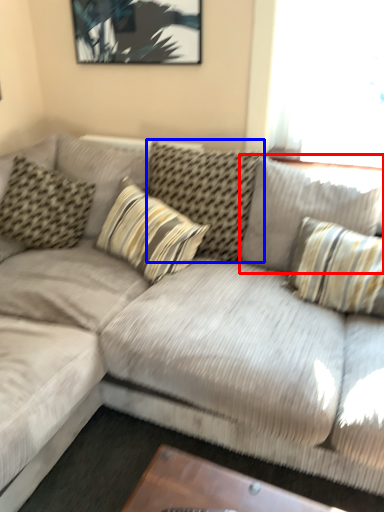
Question: Which of the following is the closest to the observer, pillow (highlighted by a red box) or pillow (highlighted by a blue box)?

Choices:
 (A) pillow
 (B) pillow

Answer: (A)